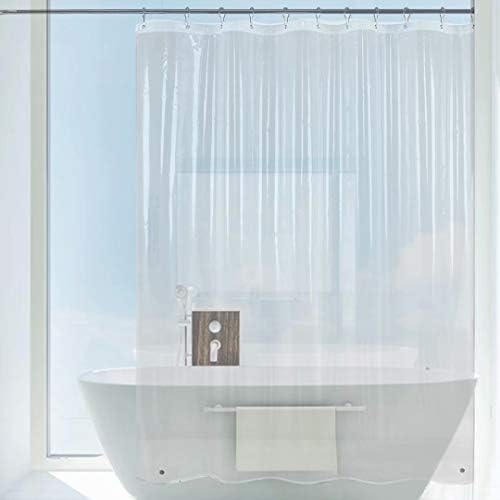
Image resolution: width=500 pixels, height=500 pixels. In order to click on floor in this screenshot , I will do `click(53, 476)`.